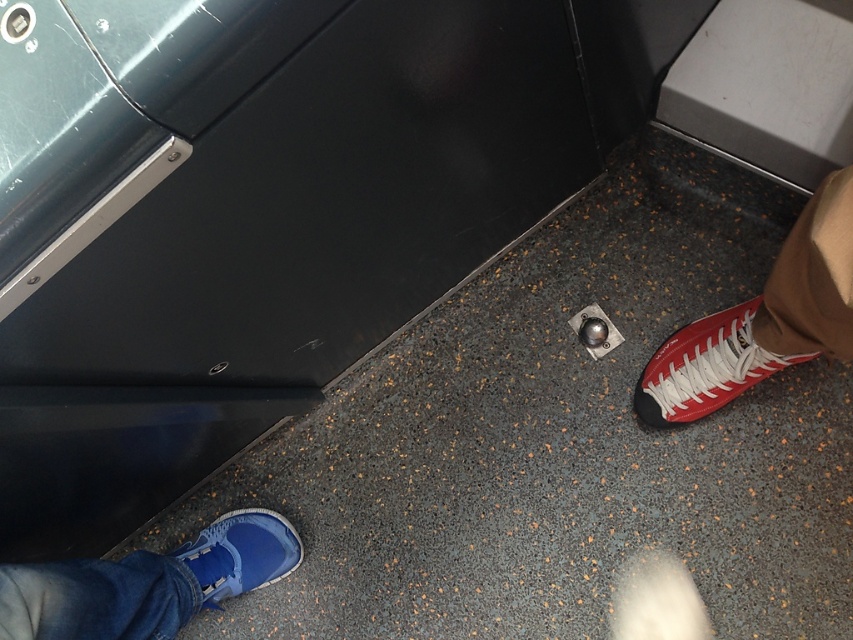
Question: Can you confirm if red leather shoe at lower right is positioned to the left of blue suede shoe at lower left?

Choices:
 (A) yes
 (B) no

Answer: (B)

Question: Considering the real-world distances, which object is farthest from the matte blue sneaker at lower left?

Choices:
 (A) red leather shoe at lower right
 (B) red leather sneaker at lower right

Answer: (A)

Question: Is blue suede shoe at lower left behind matte blue sneaker at lower left?

Choices:
 (A) yes
 (B) no

Answer: (B)

Question: Which point appears closest to the camera in this image?

Choices:
 (A) (764, 362)
 (B) (786, 308)
 (C) (126, 605)

Answer: (C)

Question: Estimate the real-world distances between objects in this image. Which object is closer to the matte blue sneaker at lower left?

Choices:
 (A) red leather sneaker at lower right
 (B) blue suede shoe at lower left

Answer: (B)

Question: Does red leather sneaker at lower right have a greater width compared to matte blue sneaker at lower left?

Choices:
 (A) yes
 (B) no

Answer: (A)